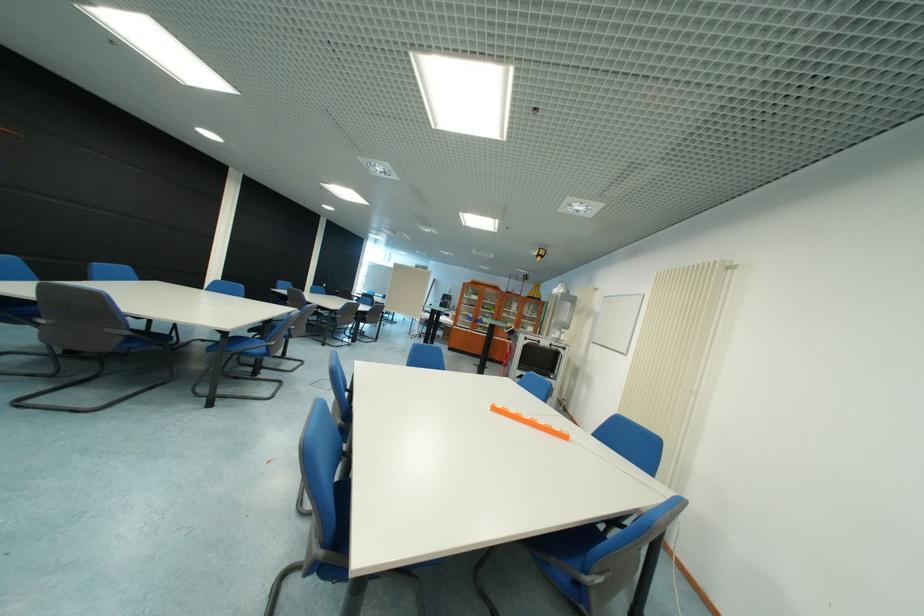
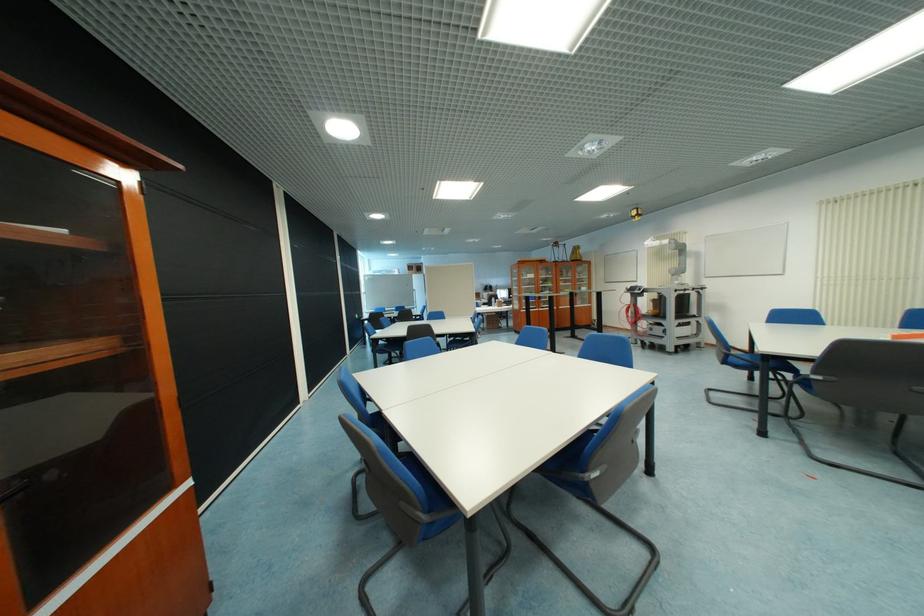
Question: In a continuous first-person perspective shot, in which direction is the camera moving?

Choices:
 (A) Left
 (B) Right
 (C) Forward
 (D) Backward

Answer: (A)